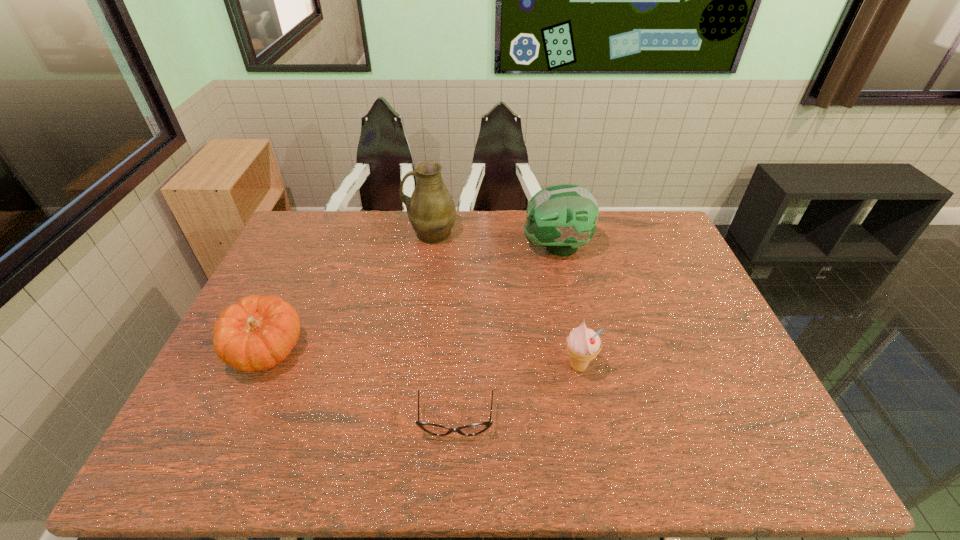
Where is `vacant space at the near edge`? This screenshot has width=960, height=540. vacant space at the near edge is located at coordinates (419, 463).

What are the coordinates of `vacant space at the right edge of the desktop` in the screenshot? It's located at (710, 407).

In the image, there is a desktop. Identify the location of free space at the far left corner. (290, 238).

Locate an element on the screen. This screenshot has width=960, height=540. free spot at the near left corner of the desktop is located at coordinates (217, 443).

Locate an element on the screen. This screenshot has height=540, width=960. vacant space at the far right corner of the desktop is located at coordinates (645, 245).

Identify the location of free space that is in between the shortest object and the pitcher. (444, 328).

Locate an element on the screen. free space between the pitcher and the football helmet is located at coordinates (493, 241).

Image resolution: width=960 pixels, height=540 pixels. Find the location of `free space between the football helmet and the icecream`. free space between the football helmet and the icecream is located at coordinates (567, 307).

The image size is (960, 540). In order to click on empty space between the pumpkin and the shortest object in this screenshot , I will do tap(362, 386).

What are the coordinates of `empty location between the pumpkin and the pitcher` in the screenshot? It's located at (349, 292).